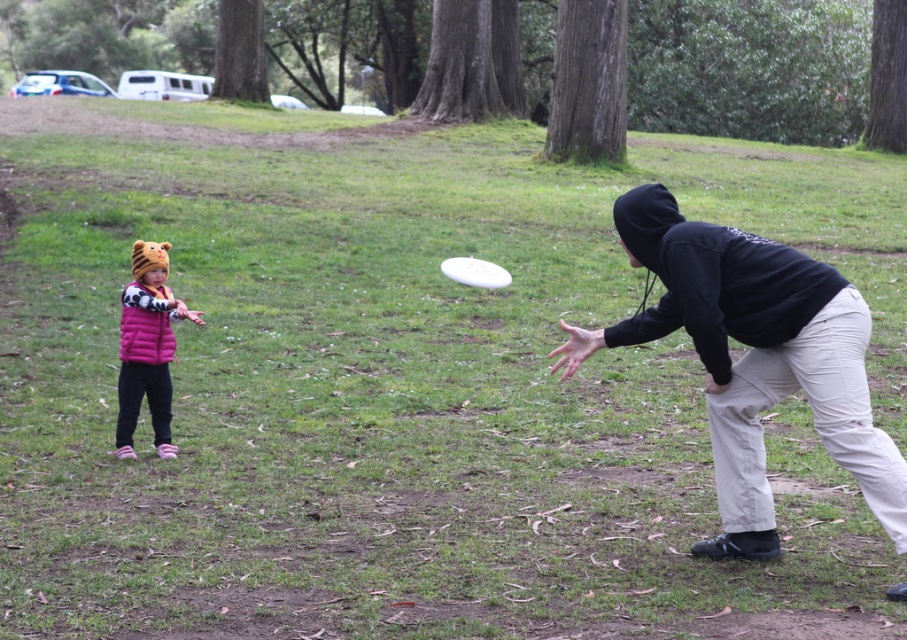
You are a photographer trying to capture a photo of both the black matte hoodie at center and the pink puffy vest at left. Based on their heights, which one should you focus on first to ensure both are in frame?

The black matte hoodie at center is much taller than the pink puffy vest at left, so you should focus on the black matte hoodie at center first to ensure both are in frame.